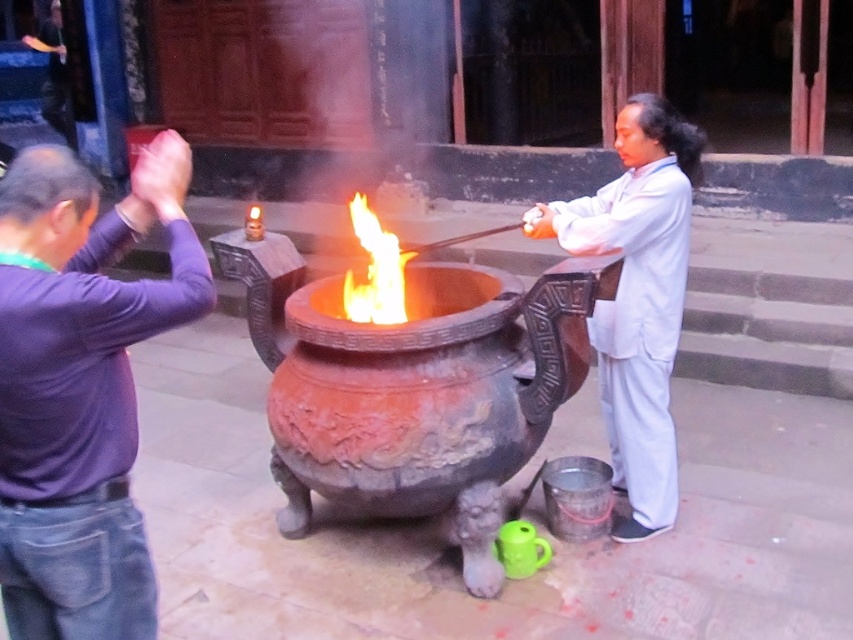
You are an anthropologist observing the scene. You notice two garments in the image. The first is the purple cotton shirt at upper left, and the second is the white matte robe at center. Which of these garments appears wider when viewed from your perspective?

The purple cotton shirt at upper left appears wider than the white matte robe at center because its width is larger according to the description.